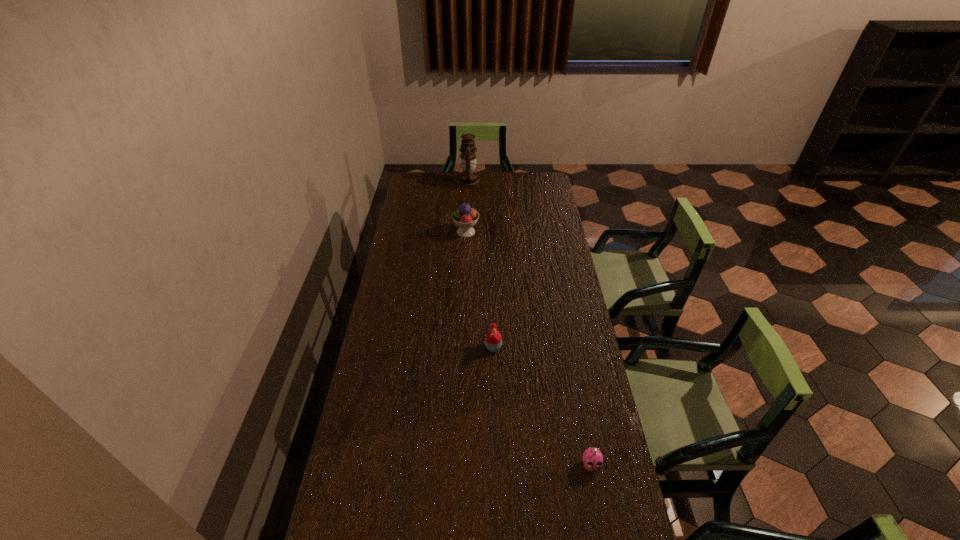
This screenshot has width=960, height=540. In the image, there is a desktop. Find the location of `vacant space at the far right corner`. vacant space at the far right corner is located at coordinates [543, 191].

Locate an element on the screen. free space between the third nearest object and the nearest object is located at coordinates (528, 348).

Where is `vacant area that lies between the second object from right to left and the icecream`? vacant area that lies between the second object from right to left and the icecream is located at coordinates (480, 289).

Find the location of a particular element. The height and width of the screenshot is (540, 960). empty location between the farther cupcake and the tallest object is located at coordinates (480, 265).

Locate an element on the screen. free space between the icecream and the right cupcake is located at coordinates (528, 348).

Locate an element on the screen. unoccupied position between the rightmost object and the third shortest object is located at coordinates (528, 348).

The image size is (960, 540). Identify the location of free space between the nearer cupcake and the lantern. (529, 323).

You are a GUI agent. You are given a task and a screenshot of the screen. Output one action in this format:
    pyautogui.click(x=<x>, y=<y>)
    Task: Click on the empty location between the tallest object and the rightmost object
    
    Given the screenshot: What is the action you would take?
    pyautogui.click(x=529, y=323)

What are the coordinates of `free area in between the farther cupcake and the farthest object` in the screenshot? It's located at (480, 265).

Identify which object is located as the second nearest to the farther cupcake. Please provide its 2D coordinates. Your answer should be formatted as a tuple, i.e. [(x, y)], where the tuple contains the x and y coordinates of a point satisfying the conditions above.

[(465, 217)]